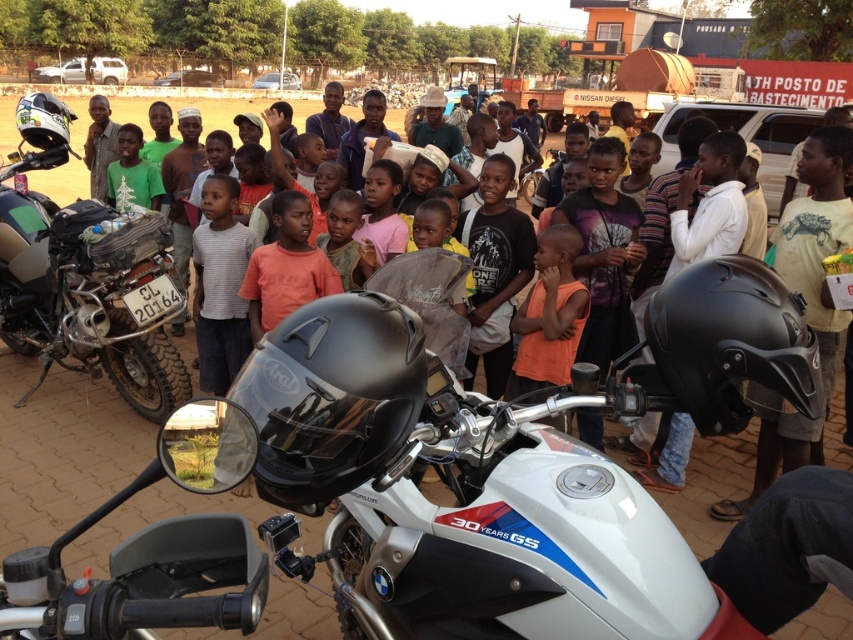
You are a photographer trying to capture a photo of the light brown skin at center without the matte black motorcycle at left blocking it. What should you do?

The matte black motorcycle at left is in front of the light brown skin at center, so you should move to the right side of the matte black motorcycle at left to get a clear view of the light brown skin at center without obstruction.

Please look at the image and locate the point at coordinates [85,278]. Which object is this point located on?

The point at coordinates [85,278] is located on the matte black motorcycle at left.

You are a photographer trying to capture a photo of both the matte black motorcycle at left and the orange matte shirt at center. Since you want to ensure both are fully visible in your shot, which object should you focus on first to account for their sizes?

The matte black motorcycle at left is taller than the orange matte shirt at center, so you should focus on the matte black motorcycle at left first to ensure its full height is captured before adjusting the frame for the orange matte shirt at center.